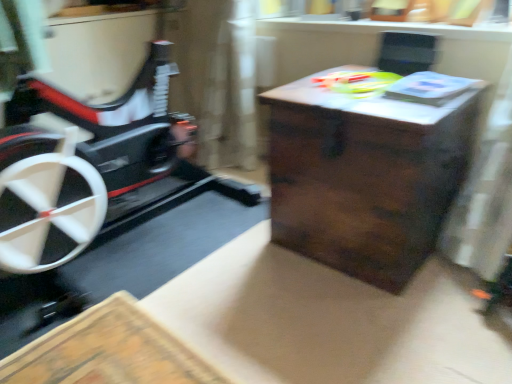
Question: Considering their positions, is translucent plastic toy at upper center located in front of or behind dark wood table at center?

Choices:
 (A) behind
 (B) front

Answer: (A)

Question: From a real-world perspective, is translucent plastic toy at upper center above or below dark wood table at center?

Choices:
 (A) above
 (B) below

Answer: (A)

Question: Visually, is translucent plastic toy at upper center positioned to the left or to the right of dark wood table at center?

Choices:
 (A) right
 (B) left

Answer: (B)

Question: Is dark wood table at center inside or outside of translucent plastic toy at upper center?

Choices:
 (A) outside
 (B) inside

Answer: (A)

Question: Looking at their shapes, would you say dark wood table at center is wider or thinner than translucent plastic toy at upper center?

Choices:
 (A) thin
 (B) wide

Answer: (B)

Question: Is dark wood table at center in front of or behind translucent plastic toy at upper center in the image?

Choices:
 (A) behind
 (B) front

Answer: (B)

Question: Does point (416, 195) appear closer or farther from the camera than point (393, 81)?

Choices:
 (A) closer
 (B) farther

Answer: (A)